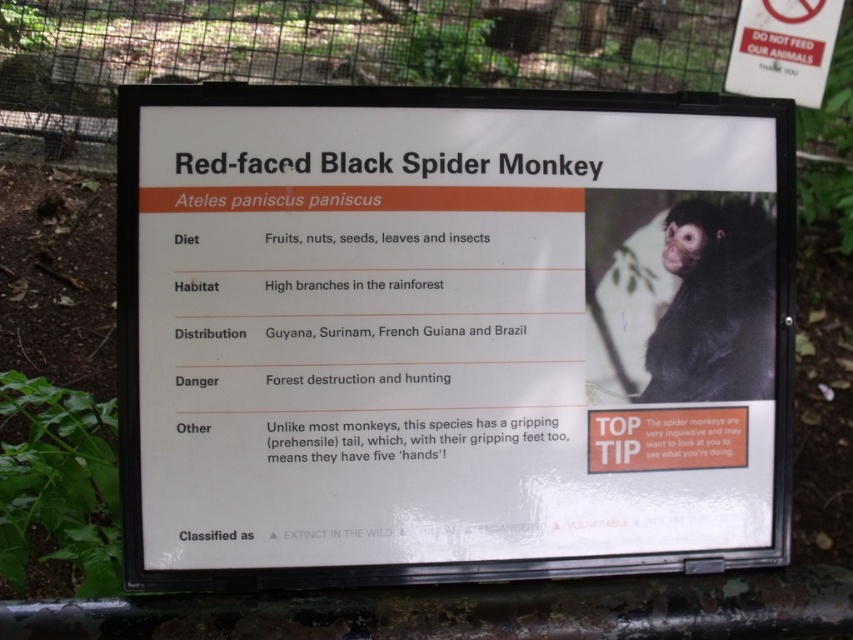
Which of these two, white plastic sign at center or black furry monkey at upper right, stands shorter?

Standing shorter between the two is black furry monkey at upper right.

Can you confirm if white plastic sign at center is taller than black furry monkey at upper right?

Correct, white plastic sign at center is much taller as black furry monkey at upper right.

Is point (619, 138) farther from camera compared to point (695, 260)?

No.

The height and width of the screenshot is (640, 853). In order to click on white plastic sign at center in this screenshot , I will do `click(450, 333)`.